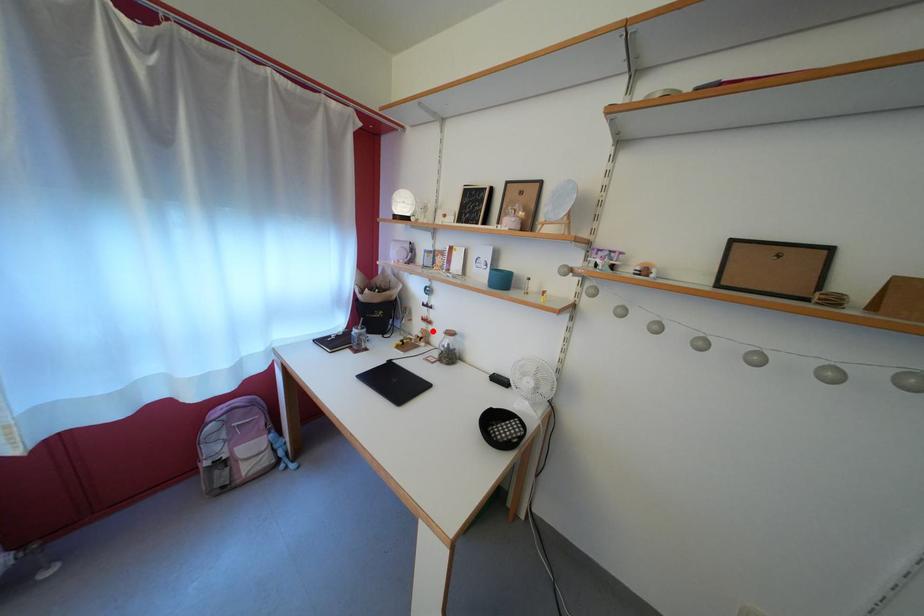
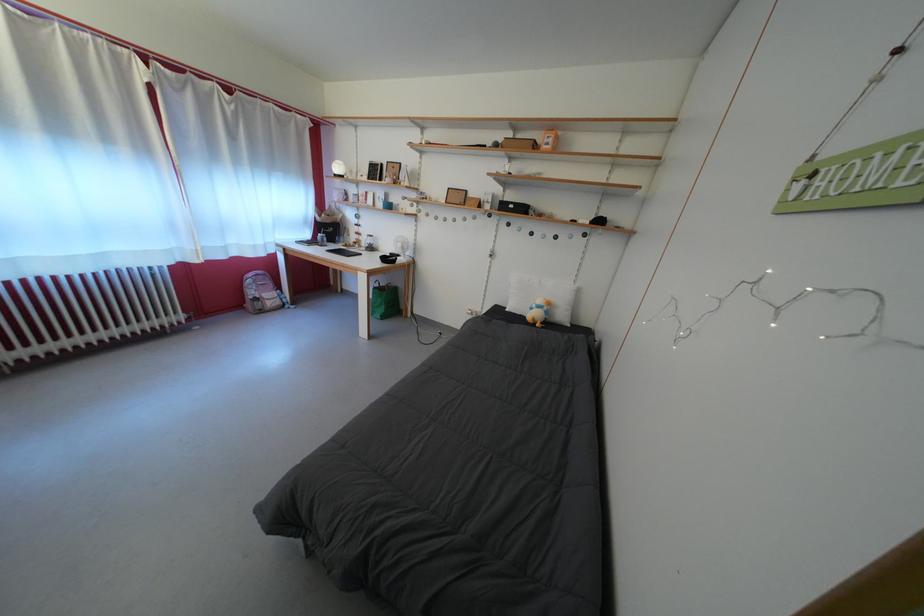
Find the pixel in the second image that matches the highlighted location in the first image.

(365, 243)